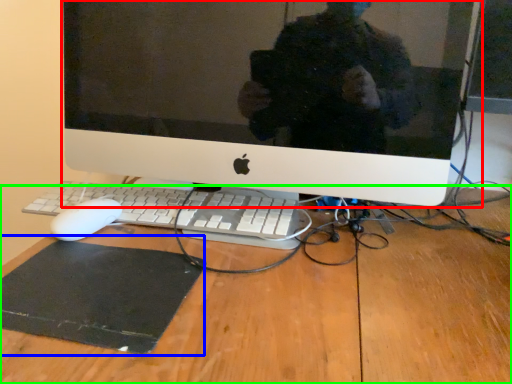
Question: Based on their relative distances, which object is farther from computer monitor (highlighted by a red box)? Choose from mousepad (highlighted by a blue box) and desk (highlighted by a green box).

Choices:
 (A) mousepad
 (B) desk

Answer: (A)